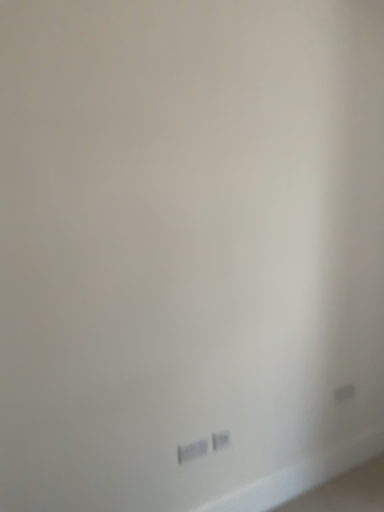
Question: Are white plastic power plug at lower center, the second power plugs and sockets viewed from the left, and white plastic power plugs and sockets at lower center, which is the 2th power plugs and sockets in back-to-front order, far apart?

Choices:
 (A) yes
 (B) no

Answer: (B)

Question: Is white plastic power plug at lower center, which is counted as the first power plugs and sockets, starting from the right, facing towards white plastic power plugs and sockets at lower center, the 1th power plugs and sockets in the left-to-right sequence?

Choices:
 (A) yes
 (B) no

Answer: (B)

Question: Is white plastic power plug at lower center, the second power plugs and sockets viewed from the left, at the right side of white plastic power plugs and sockets at lower center, which is the 2th power plugs and sockets in back-to-front order?

Choices:
 (A) yes
 (B) no

Answer: (A)

Question: Considering the relative sizes of white plastic power plug at lower center, arranged as the 2th power plugs and sockets when viewed from the front, and white plastic power plugs and sockets at lower center, which is the 2th power plugs and sockets in back-to-front order, in the image provided, is white plastic power plug at lower center, arranged as the 2th power plugs and sockets when viewed from the front, taller than white plastic power plugs and sockets at lower center, which is the 2th power plugs and sockets in back-to-front order,?

Choices:
 (A) no
 (B) yes

Answer: (B)

Question: Is the depth of white plastic power plug at lower center, arranged as the 2th power plugs and sockets when viewed from the front, less than that of white plastic power plugs and sockets at lower center, which is the 2th power plugs and sockets in back-to-front order?

Choices:
 (A) yes
 (B) no

Answer: (B)

Question: Is white plastic power plug at lower center, arranged as the 2th power plugs and sockets when viewed from the front, bigger than white plastic power plugs and sockets at lower center, the 1th power plugs and sockets when ordered from front to back?

Choices:
 (A) yes
 (B) no

Answer: (B)

Question: Is white plastic power plug at lower center, which is counted as the first power plugs and sockets, starting from the right, completely or partially inside white plastic power plugs and sockets at lower center, which is the 2th power plugs and sockets in back-to-front order?

Choices:
 (A) yes
 (B) no

Answer: (B)

Question: Is white plastic power plugs and sockets at lower center, the 1th power plugs and sockets when ordered from front to back, outside of white plastic power plug at lower center, which is counted as the first power plugs and sockets, starting from the right?

Choices:
 (A) yes
 (B) no

Answer: (A)

Question: Can you confirm if white plastic power plugs and sockets at lower center, which is counted as the second power plugs and sockets, starting from the right, is smaller than white plastic power plug at lower center, the second power plugs and sockets viewed from the left?

Choices:
 (A) yes
 (B) no

Answer: (B)

Question: From the image's perspective, is white plastic power plugs and sockets at lower center, the 1th power plugs and sockets when ordered from front to back, above white plastic power plug at lower center, which is counted as the first power plugs and sockets, starting from the right?

Choices:
 (A) yes
 (B) no

Answer: (B)

Question: Can you confirm if white plastic power plugs and sockets at lower center, the 1th power plugs and sockets in the left-to-right sequence, is positioned to the left of white plastic power plug at lower center, positioned as the 1th power plugs and sockets in back-to-front order?

Choices:
 (A) yes
 (B) no

Answer: (A)

Question: From a real-world perspective, is white plastic power plugs and sockets at lower center, which is counted as the second power plugs and sockets, starting from the right, over white plastic power plug at lower center, positioned as the 1th power plugs and sockets in back-to-front order?

Choices:
 (A) no
 (B) yes

Answer: (A)

Question: Relative to white plastic power plugs and sockets at lower center, the 1th power plugs and sockets when ordered from front to back, is white plastic power plug at lower center, the second power plugs and sockets viewed from the left, in front or behind?

Choices:
 (A) behind
 (B) front

Answer: (A)